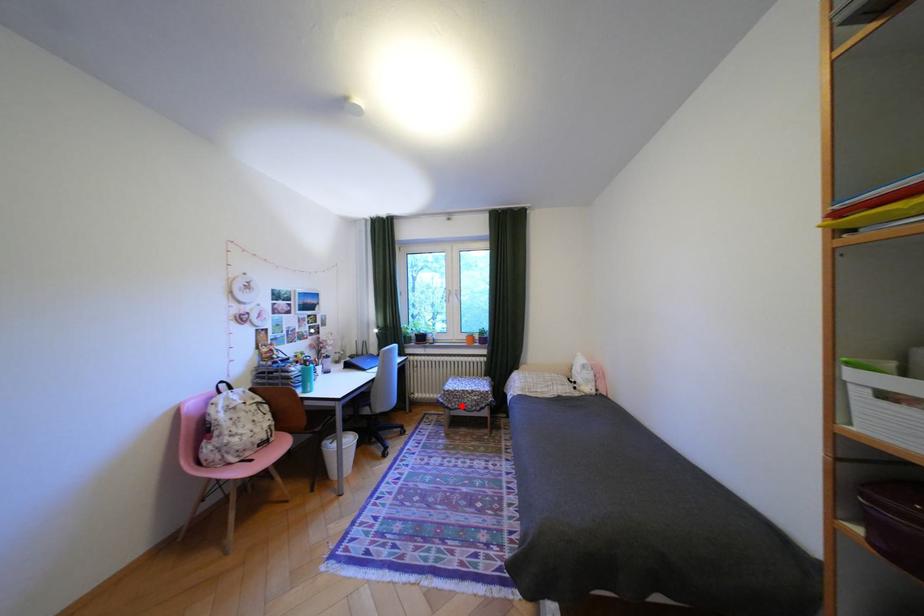
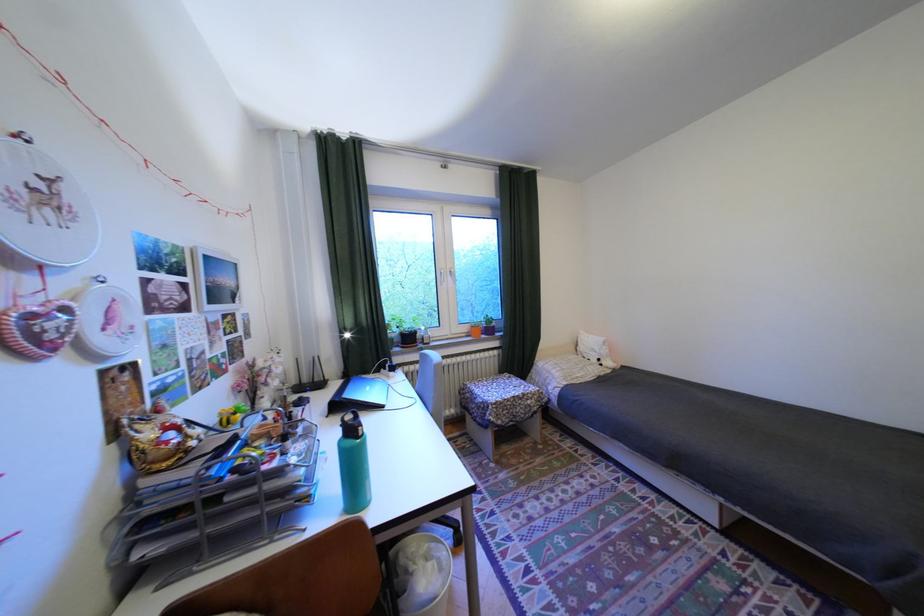
Find the pixel in the second image that matches the highlighted location in the first image.

(512, 422)